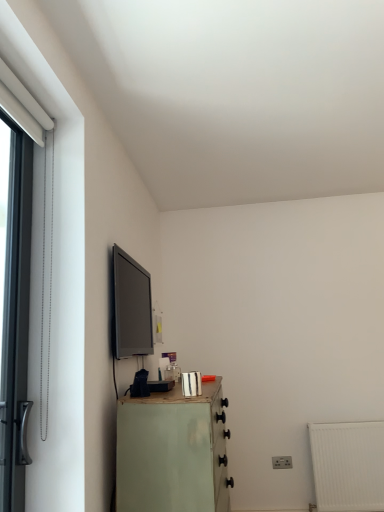
Question: Is black metal door at left oriented away from matte black tv at upper left?

Choices:
 (A) yes
 (B) no

Answer: (B)

Question: Is black metal door at left next to matte black tv at upper left?

Choices:
 (A) no
 (B) yes

Answer: (A)

Question: From a real-world perspective, is black metal door at left physically below matte black tv at upper left?

Choices:
 (A) no
 (B) yes

Answer: (B)

Question: From a real-world perspective, is black metal door at left physically above matte black tv at upper left?

Choices:
 (A) yes
 (B) no

Answer: (B)

Question: Does black metal door at left appear on the right side of matte black tv at upper left?

Choices:
 (A) no
 (B) yes

Answer: (A)

Question: Is black metal door at left positioned far away from matte black tv at upper left?

Choices:
 (A) yes
 (B) no

Answer: (A)

Question: Does light green painted wood chest of drawers at lower left lie in front of matte black tv at upper left?

Choices:
 (A) yes
 (B) no

Answer: (A)

Question: Is light green painted wood chest of drawers at lower left shorter than matte black tv at upper left?

Choices:
 (A) no
 (B) yes

Answer: (A)

Question: Is light green painted wood chest of drawers at lower left oriented towards matte black tv at upper left?

Choices:
 (A) no
 (B) yes

Answer: (A)

Question: Does light green painted wood chest of drawers at lower left come behind matte black tv at upper left?

Choices:
 (A) yes
 (B) no

Answer: (B)

Question: From a real-world perspective, is light green painted wood chest of drawers at lower left beneath matte black tv at upper left?

Choices:
 (A) no
 (B) yes

Answer: (B)

Question: Is light green painted wood chest of drawers at lower left at the left side of matte black tv at upper left?

Choices:
 (A) yes
 (B) no

Answer: (B)

Question: Can you confirm if metallic silver canister at lower center is wider than black metal door at left?

Choices:
 (A) no
 (B) yes

Answer: (B)